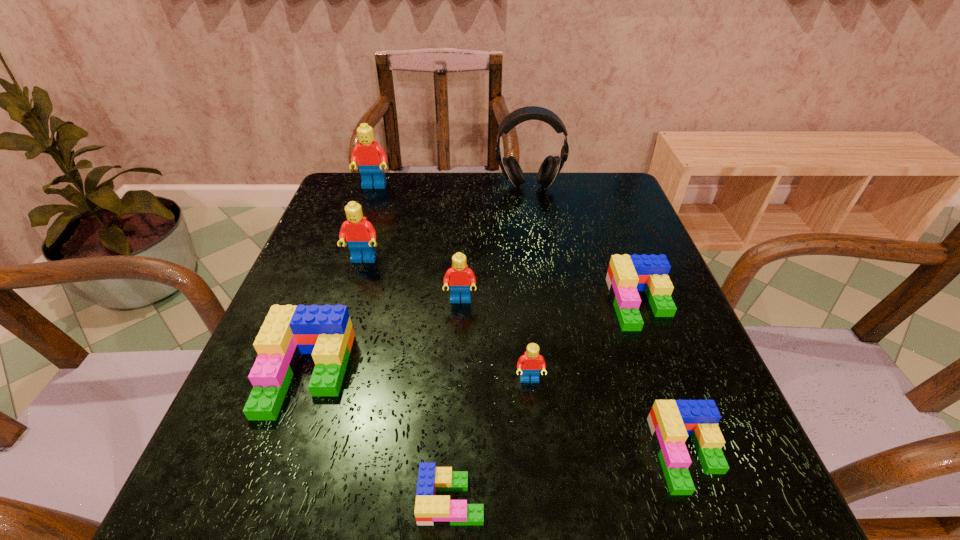
Find the location of a particular element. The image size is (960, 540). earphone is located at coordinates (551, 166).

At what (x,y) coordinates should I click in order to perform the action: click on the tallest object. Please return your answer as a coordinate pair (x, y). The image size is (960, 540). Looking at the image, I should click on (551, 166).

Image resolution: width=960 pixels, height=540 pixels. What are the coordinates of `the farthest red Lego` in the screenshot? It's located at (370, 157).

Locate an element on the screen. Image resolution: width=960 pixels, height=540 pixels. the biggest red Lego is located at coordinates (370, 157).

Find the location of a particular element. the third farthest object is located at coordinates (360, 234).

The image size is (960, 540). In order to click on the third smallest red Lego in this screenshot , I will do `click(360, 234)`.

The image size is (960, 540). Find the location of `the second nearest red Lego`. the second nearest red Lego is located at coordinates (461, 278).

You are a GUI agent. You are given a task and a screenshot of the screen. Output one action in this format:
    pyautogui.click(x=<x>, y=<y>)
    Task: Click on the third red Lego from left to right
    This screenshot has height=540, width=960.
    Given the screenshot: What is the action you would take?
    pyautogui.click(x=461, y=278)

This screenshot has height=540, width=960. In order to click on the third Lego from right to left in this screenshot , I will do `click(529, 364)`.

Locate an element on the screen. the smallest red Lego is located at coordinates (529, 364).